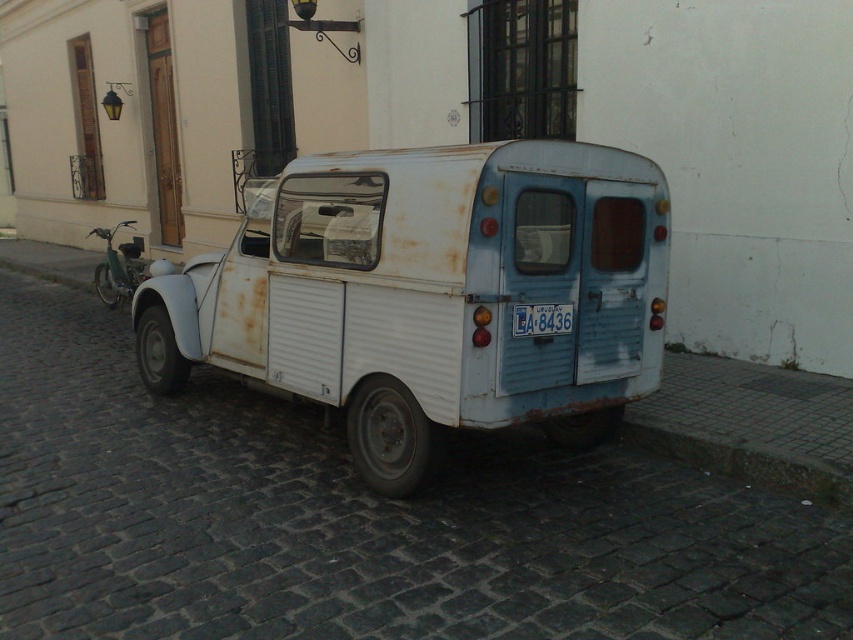
Between point (294, 310) and point (537, 314), which one is positioned in front?

Positioned in front is point (537, 314).

Which is above, rusty metal van at center or white plastic license plate at center?

white plastic license plate at center is above.

This screenshot has width=853, height=640. I want to click on rusty metal van at center, so click(x=430, y=294).

Where is `rusty metal van at center`? This screenshot has width=853, height=640. rusty metal van at center is located at coordinates (430, 294).